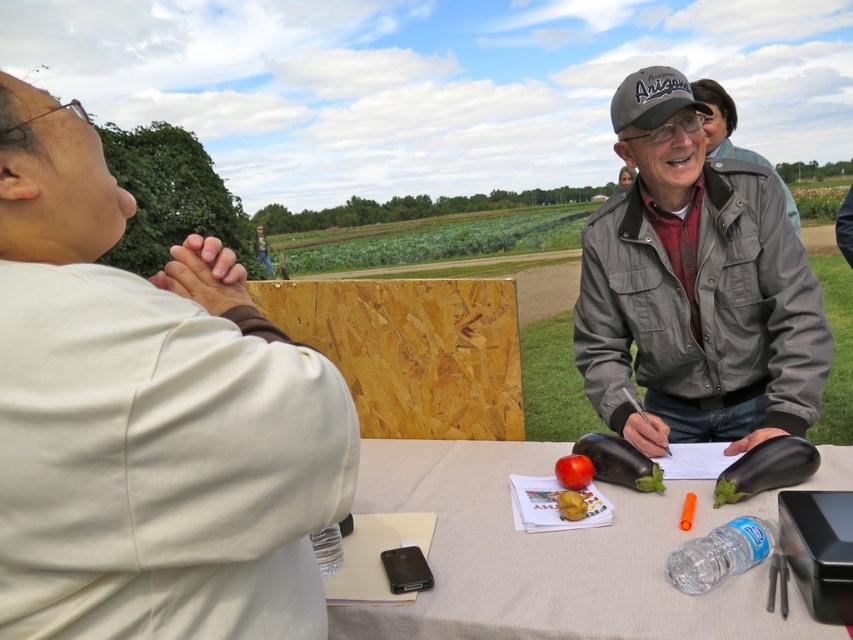
Question: Does white fabric table at center have a larger size compared to yellow matte potato at center?

Choices:
 (A) no
 (B) yes

Answer: (B)

Question: Which of the following is the farthest from the observer?

Choices:
 (A) (51, 192)
 (B) (577, 513)

Answer: (B)

Question: Where is white matte shirt at upper left located in relation to yellow matte potato at center in the image?

Choices:
 (A) right
 (B) left

Answer: (B)

Question: Which is farther from the white fabric table at center?

Choices:
 (A) white matte shirt at upper left
 (B) red matte tomato at center
 (C) yellow matte potato at center
 (D) gray cotton jacket at upper right

Answer: (A)

Question: Which of these objects is positioned farthest from the red matte tomato at center?

Choices:
 (A) gray cotton jacket at upper right
 (B) white matte shirt at upper left
 (C) yellow matte potato at center
 (D) white fabric table at center

Answer: (B)

Question: Is gray cotton jacket at upper right further to the viewer compared to white fabric table at center?

Choices:
 (A) yes
 (B) no

Answer: (A)